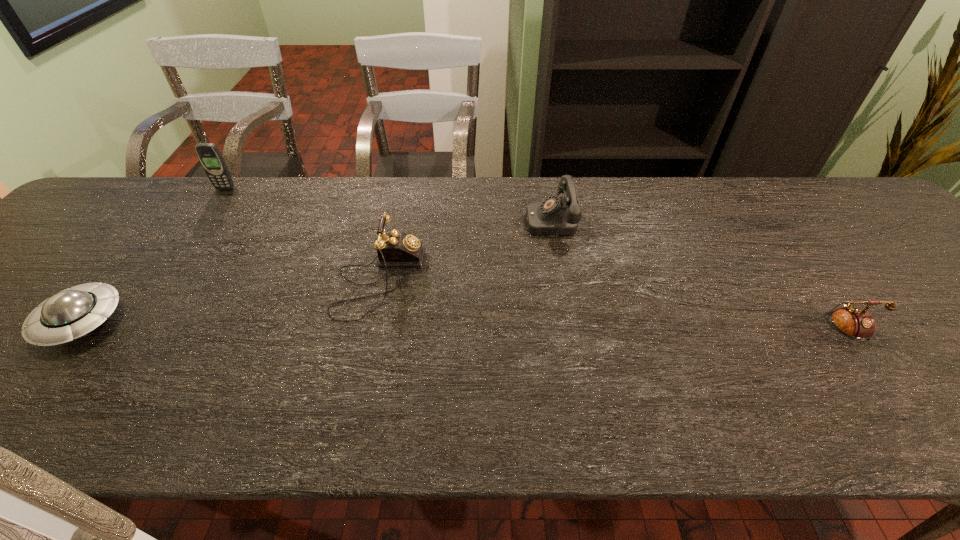
Where is `the farthest object`? The image size is (960, 540). the farthest object is located at coordinates (208, 154).

Locate an element on the screen. The image size is (960, 540). the tallest object is located at coordinates (208, 154).

Locate an element on the screen. the fourth object from left to right is located at coordinates (556, 215).

The width and height of the screenshot is (960, 540). What are the coordinates of `the second farthest object` in the screenshot? It's located at (556, 215).

I want to click on the third object from right to left, so click(x=395, y=249).

What are the coordinates of `the rightmost object` in the screenshot? It's located at click(x=855, y=323).

At what (x,y) coordinates should I click in order to perform the action: click on the rightmost telephone. Please return your answer as a coordinate pair (x, y). The height and width of the screenshot is (540, 960). Looking at the image, I should click on (855, 323).

The height and width of the screenshot is (540, 960). In order to click on saucer in this screenshot , I will do `click(72, 313)`.

Locate an element on the screen. This screenshot has width=960, height=540. free location located on the screen of the farthest object is located at coordinates (156, 289).

Locate an element on the screen. vacant region located on the dial of the farthest telephone is located at coordinates (382, 219).